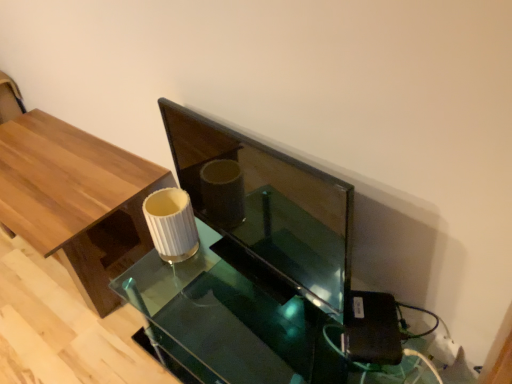
In order to face translucent glass table at center, should I rotate leftwards or rightwards?

Rotate right and turn 1.707 degrees.

At what (x,y) coordinates should I click in order to perform the action: click on translucent glass table at center. Please return your answer as a coordinate pair (x, y). Looking at the image, I should click on (232, 318).

What is the approximate width of translucent glass table at center?

It is 21.34 inches.

Image resolution: width=512 pixels, height=384 pixels. Describe the element at coordinates (232, 318) in the screenshot. I see `translucent glass table at center` at that location.

What do you see at coordinates (76, 200) in the screenshot? The image size is (512, 384). I see `wooden table at left` at bounding box center [76, 200].

Measure the distance between point (x=68, y=204) and camera.

Point (x=68, y=204) and camera are 1.56 meters apart from each other.

Identify the location of wooden table at left. (76, 200).

Image resolution: width=512 pixels, height=384 pixels. I want to click on translucent glass table at center, so click(x=232, y=318).

Can you confirm if translucent glass table at center is positioned to the right of wooden table at left?

Yes.

Is translucent glass table at center positioned in front of wooden table at left?

Yes, translucent glass table at center is in front of wooden table at left.

Is point (251, 299) closer or farther from the camera than point (86, 216)?

Clearly, point (251, 299) is closer to the camera than point (86, 216).

From the image's perspective, is translucent glass table at center above wooden table at left?

Actually, translucent glass table at center appears below wooden table at left in the image.

From a real-world perspective, which object stands above the other?

wooden table at left, from a real-world perspective.

Can you confirm if translucent glass table at center is thinner than wooden table at left?

Correct, the width of translucent glass table at center is less than that of wooden table at left.

From the picture: Does translucent glass table at center have a greater height compared to wooden table at left?

Incorrect, the height of translucent glass table at center is not larger of that of wooden table at left.

Considering the sizes of objects translucent glass table at center and wooden table at left in the image provided, who is smaller, translucent glass table at center or wooden table at left?

translucent glass table at center is smaller.

Does translucent glass table at center contain wooden table at left?

No, translucent glass table at center does not contain wooden table at left.

Are translucent glass table at center and wooden table at left located far from each other?

translucent glass table at center is actually quite close to wooden table at left.

Could you tell me if translucent glass table at center is facing wooden table at left?

No, translucent glass table at center is not oriented towards wooden table at left.

Locate an element on the screen. This screenshot has width=512, height=384. round table located on the right of wooden table at left is located at coordinates (232, 318).

Between wooden table at left and translucent glass table at center, which one appears on the right side from the viewer's perspective?

Positioned to the right is translucent glass table at center.

Is wooden table at left in front of or behind translucent glass table at center in the image?

wooden table at left is behind translucent glass table at center.

Is point (118, 250) more distant than point (179, 361)?

Yes, point (118, 250) is behind point (179, 361).

From the image's perspective, who appears lower, wooden table at left or translucent glass table at center?

translucent glass table at center is shown below in the image.

From a real-world perspective, is wooden table at left above or below translucent glass table at center?

From a real-world perspective, wooden table at left is physically above translucent glass table at center.

Considering the relative sizes of wooden table at left and translucent glass table at center in the image provided, is wooden table at left thinner than translucent glass table at center?

In fact, wooden table at left might be wider than translucent glass table at center.

Consider the image. Which of these two, wooden table at left or translucent glass table at center, stands taller?

Standing taller between the two is wooden table at left.

Looking at this image, considering the relative sizes of wooden table at left and translucent glass table at center in the image provided, is wooden table at left bigger than translucent glass table at center?

Yes.

Do you think wooden table at left is within translucent glass table at center, or outside of it?

wooden table at left is not enclosed by translucent glass table at center.

Is the surface of wooden table at left in direct contact with translucent glass table at center?

wooden table at left is not next to translucent glass table at center, and they're not touching.

Is wooden table at left facing towards translucent glass table at center?

No, wooden table at left is not turned towards translucent glass table at center.

What's the angular difference between wooden table at left and translucent glass table at center's facing directions?

0.309 degrees separate the facing orientations of wooden table at left and translucent glass table at center.

In the image, there is a wooden table at left. At what (x,y) coordinates should I click in order to perform the action: click on round table below it (from a real-world perspective). Please return your answer as a coordinate pair (x, y). The width and height of the screenshot is (512, 384). Looking at the image, I should click on (232, 318).

I want to click on table behind the translucent glass table at center, so click(76, 200).

Where is `round table below the wooden table at left (from a real-world perspective)`? This screenshot has width=512, height=384. round table below the wooden table at left (from a real-world perspective) is located at coordinates (232, 318).